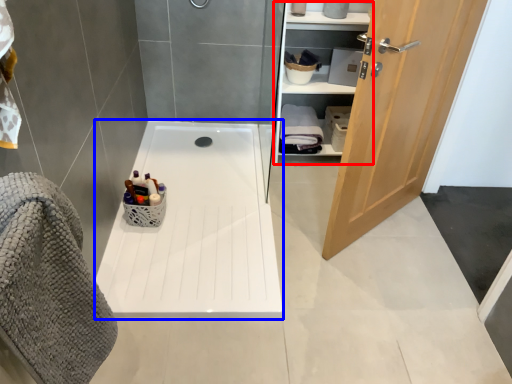
Question: Which point is further to the camera, closet (highlighted by a red box) or bath (highlighted by a blue box)?

Choices:
 (A) closet
 (B) bath

Answer: (A)